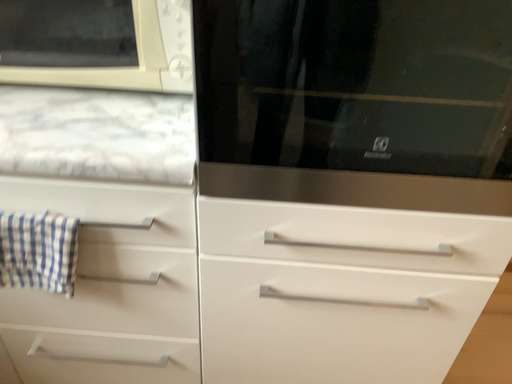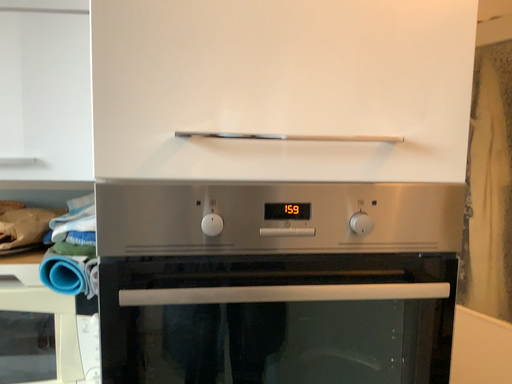
Question: Which way did the camera rotate in the video?

Choices:
 (A) rotated downward
 (B) rotated upward

Answer: (B)